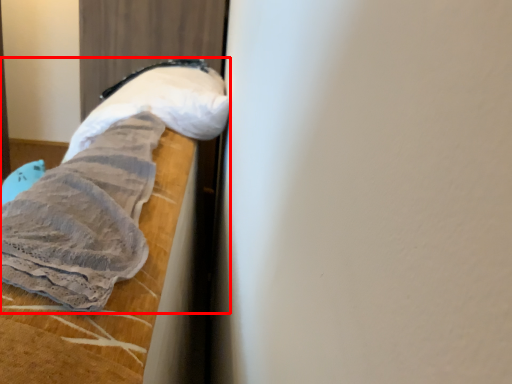
Question: Observing the image, what is the correct spatial positioning of sheet (annotated by the red box) in reference to footwear?

Choices:
 (A) left
 (B) right

Answer: (B)